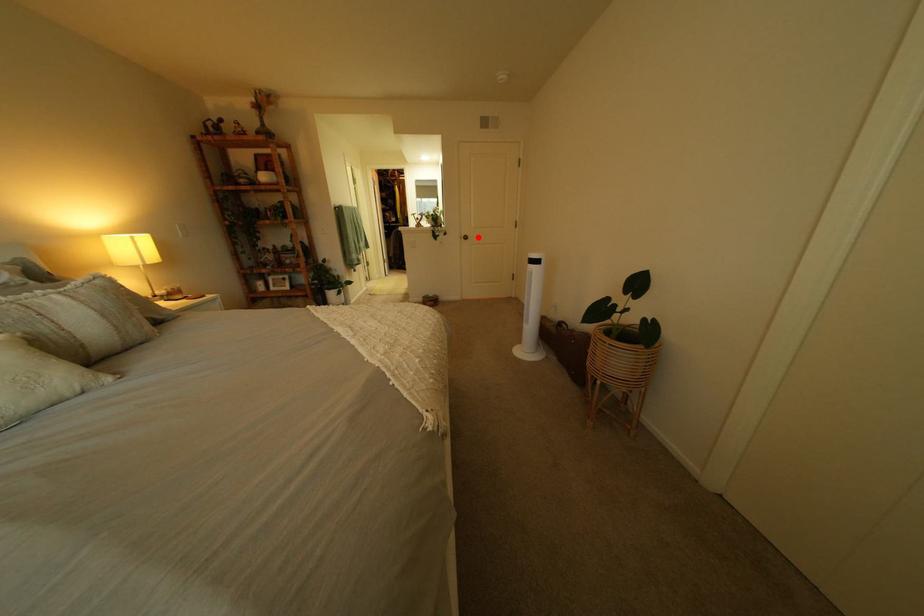
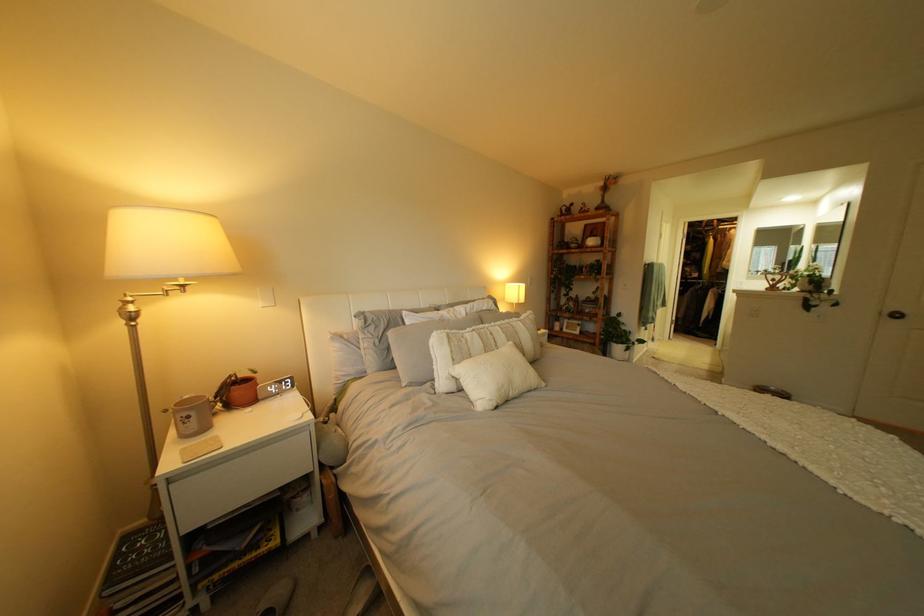
Locate, in the second image, the point that corresponds to the highlighted location in the first image.

(903, 313)